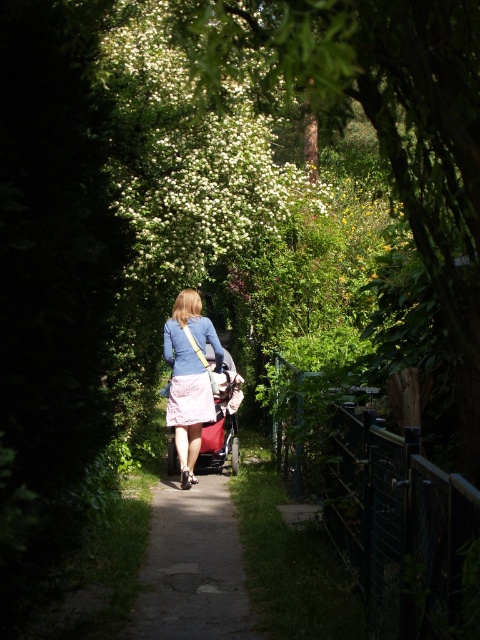
Consider the image. You are a photographer trying to capture the woman in the scene. You notice both the pink fabric skirt at center and the pink satin dress at center. Which one is lower on her body?

The pink fabric skirt at center is positioned under the pink satin dress at center, so the skirt is lower on her body.

You are standing at the starting point of the paved asphalt path at center and see the pink satin dress at center ahead. Which object is closer to you?

The paved asphalt path at center is closer to you because it is in front of the pink satin dress at center.

You are a photographer trying to capture the entire paved asphalt path at center and pink fabric skirt at center in one frame. Based on their sizes, which object would require you to adjust your camera angle to ensure both are fully visible?

The pink fabric skirt at center is larger than the paved asphalt path at center, so you would need to adjust your camera angle to accommodate its size to ensure both are fully visible.